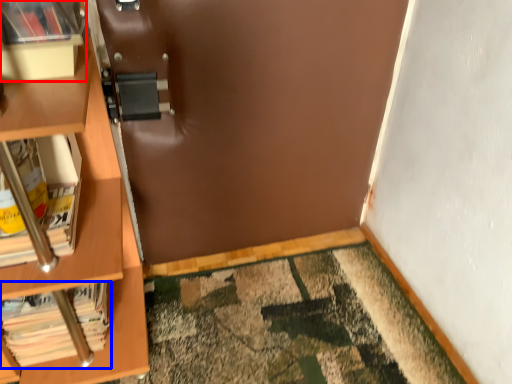
Question: Which object is closer to the camera taking this photo, shelf (highlighted by a red box) or book (highlighted by a blue box)?

Choices:
 (A) shelf
 (B) book

Answer: (A)